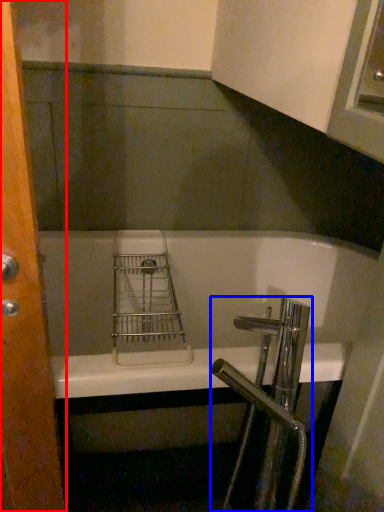
Question: Among these objects, which one is nearest to the camera, screen door (highlighted by a red box) or tap (highlighted by a blue box)?

Choices:
 (A) screen door
 (B) tap

Answer: (A)